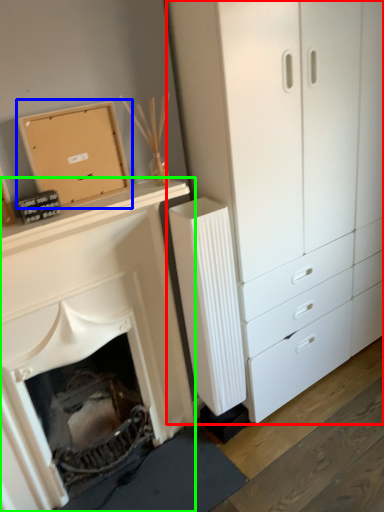
Question: Based on their relative distances, which object is nearer to chest of drawers (highlighted by a red box)? Choose from cardboard box (highlighted by a blue box) and fireplace (highlighted by a green box).

Choices:
 (A) cardboard box
 (B) fireplace

Answer: (B)